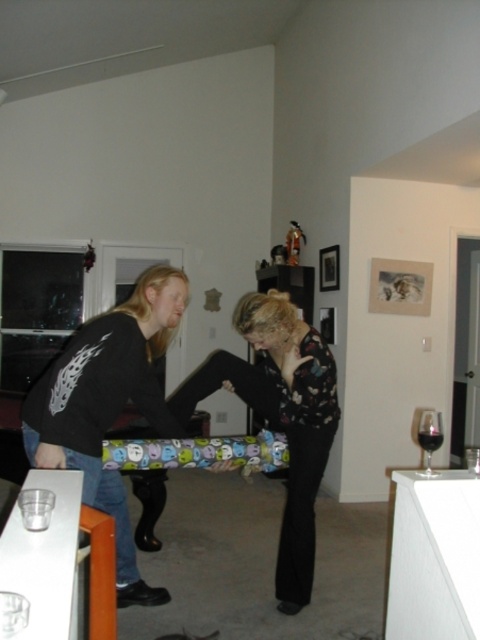
Measure the distance from matte black shirt at center to transparent glass at right.

32.67 inches

Is matte black shirt at center positioned at the back of transparent glass at right?

That is True.

Is point (132, 552) positioned before point (437, 429)?

No, it is behind (437, 429).

This screenshot has width=480, height=640. I want to click on matte black shirt at center, so click(202, 397).

Does transparent glass at right come behind dark glass wine at lower right?

Yes, transparent glass at right is further from the viewer.

Is transparent glass at right shorter than dark glass wine at lower right?

No, transparent glass at right is not shorter than dark glass wine at lower right.

Where is `transparent glass at right`? The width and height of the screenshot is (480, 640). transparent glass at right is located at coordinates (430, 436).

At what (x,y) coordinates should I click in order to perform the action: click on transparent glass at right. Please return your answer as a coordinate pair (x, y). The height and width of the screenshot is (640, 480). Looking at the image, I should click on (430, 436).

Is point (279, 557) in front of point (420, 433)?

That is False.

Which is behind, point (267, 340) or point (420, 432)?

Positioned behind is point (267, 340).

The width and height of the screenshot is (480, 640). I want to click on matte black shirt at center, so click(202, 397).